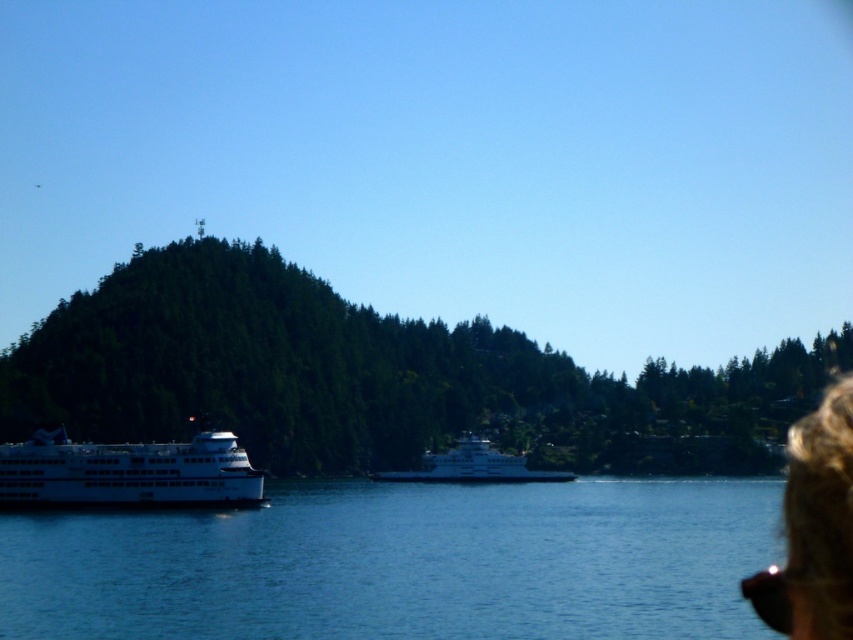
Question: Observing the image, what is the correct spatial positioning of green textured hillside at center in reference to blue water at center?

Choices:
 (A) above
 (B) below

Answer: (A)

Question: Is blue water at center to the right of white glossy ferry at center from the viewer's perspective?

Choices:
 (A) no
 (B) yes

Answer: (A)

Question: Among these objects, which one is farthest from the camera?

Choices:
 (A) white glossy ferry at lower left
 (B) white glossy ferry at center
 (C) brown curly hair at lower right

Answer: (B)

Question: Which point is closer to the camera taking this photo?

Choices:
 (A) (19, 381)
 (B) (399, 477)

Answer: (B)

Question: Which of the following is the closest to the observer?

Choices:
 (A) blue water at center
 (B) brown curly hair at lower right

Answer: (B)

Question: Is green textured hillside at center bigger than brown curly hair at lower right?

Choices:
 (A) no
 (B) yes

Answer: (B)